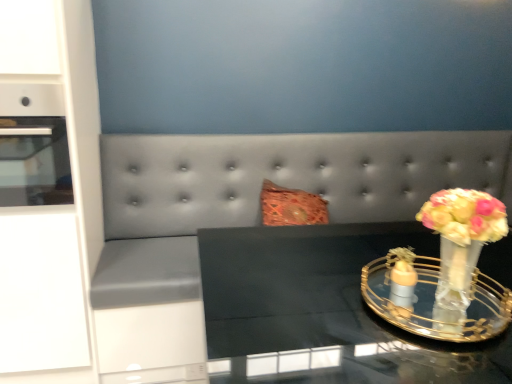
The height and width of the screenshot is (384, 512). Identify the location of translucent glass vase at right. (462, 238).

Describe the element at coordinates (462, 238) in the screenshot. I see `translucent glass vase at right` at that location.

I want to click on clear glass vase at right, which is counted as the first candle holder, starting from the right, so (x=435, y=303).

What do you see at coordinates (401, 279) in the screenshot?
I see `matte orange glass candle holder at right, the 2th candle holder from the right` at bounding box center [401, 279].

Where is `matte orange glass candle holder at right, the 1th candle holder positioned from the left`? Image resolution: width=512 pixels, height=384 pixels. matte orange glass candle holder at right, the 1th candle holder positioned from the left is located at coordinates (401, 279).

Identify the location of translucent glass vase at right. (462, 238).

Is suede gray couch at center facing away from clear glass vase at right, which is counted as the first candle holder, starting from the right?

No, suede gray couch at center is not facing the opposite direction of clear glass vase at right, which is counted as the first candle holder, starting from the right.

Is suede gray couch at center further to the viewer compared to clear glass vase at right, the 2th candle holder from the left?

Yes, it is behind clear glass vase at right, the 2th candle holder from the left.

Does suede gray couch at center appear on the left side of clear glass vase at right, which is counted as the first candle holder, starting from the right?

Correct, you'll find suede gray couch at center to the left of clear glass vase at right, which is counted as the first candle holder, starting from the right.

Does suede gray couch at center have a lesser width compared to clear glass vase at right, which is counted as the first candle holder, starting from the right?

No.

Consider the image. Is white glossy cabinet at left shorter than clear glass vase at right, the 2th candle holder from the left?

No.

Is white glossy cabinet at left oriented towards clear glass vase at right, which is counted as the first candle holder, starting from the right?

No, white glossy cabinet at left is not facing towards clear glass vase at right, which is counted as the first candle holder, starting from the right.

Which of these two, white glossy cabinet at left or clear glass vase at right, which is counted as the first candle holder, starting from the right, is bigger?

white glossy cabinet at left is bigger.

Considering the relative sizes of white glossy cabinet at left and clear glass vase at right, which is counted as the first candle holder, starting from the right, in the image provided, is white glossy cabinet at left thinner than clear glass vase at right, which is counted as the first candle holder, starting from the right,?

No.

Considering the relative positions of matte orange glass candle holder at right, the 2th candle holder from the right, and white glossy cabinet at left in the image provided, is matte orange glass candle holder at right, the 2th candle holder from the right, to the right of white glossy cabinet at left from the viewer's perspective?

Yes, matte orange glass candle holder at right, the 2th candle holder from the right, is to the right of white glossy cabinet at left.

Which of these two, matte orange glass candle holder at right, the 1th candle holder positioned from the left, or white glossy cabinet at left, stands shorter?

With less height is matte orange glass candle holder at right, the 1th candle holder positioned from the left.

Is matte orange glass candle holder at right, the 1th candle holder positioned from the left, not within white glossy cabinet at left?

Yes, matte orange glass candle holder at right, the 1th candle holder positioned from the left, is located beyond the bounds of white glossy cabinet at left.

Can you confirm if matte orange glass candle holder at right, the 1th candle holder positioned from the left, is smaller than white glossy cabinet at left?

Indeed, matte orange glass candle holder at right, the 1th candle holder positioned from the left, has a smaller size compared to white glossy cabinet at left.

Is suede gray couch at center in front of or behind translucent glass vase at right in the image?

suede gray couch at center is behind translucent glass vase at right.

Is suede gray couch at center inside the boundaries of translucent glass vase at right, or outside?

suede gray couch at center exists outside the volume of translucent glass vase at right.

Considering the positions of points (317, 176) and (490, 195), is point (317, 176) farther from camera compared to point (490, 195)?

No, it is not.

Looking at their sizes, would you say matte orange glass candle holder at right, the 1th candle holder positioned from the left, is wider or thinner than clear glass vase at right, the 2th candle holder from the left?

matte orange glass candle holder at right, the 1th candle holder positioned from the left, is thinner than clear glass vase at right, the 2th candle holder from the left.

Is matte orange glass candle holder at right, the 1th candle holder positioned from the left, with clear glass vase at right, which is counted as the first candle holder, starting from the right?

Yes.

From a real-world perspective, who is located higher, matte orange glass candle holder at right, the 2th candle holder from the right, or clear glass vase at right, which is counted as the first candle holder, starting from the right?

matte orange glass candle holder at right, the 2th candle holder from the right, is physically above.

Looking at their sizes, would you say matte orange glass candle holder at right, the 2th candle holder from the right, is wider or thinner than suede gray couch at center?

matte orange glass candle holder at right, the 2th candle holder from the right, is thinner than suede gray couch at center.

Is matte orange glass candle holder at right, the 1th candle holder positioned from the left, aimed at suede gray couch at center?

No, matte orange glass candle holder at right, the 1th candle holder positioned from the left, does not turn towards suede gray couch at center.

Considering their positions, is matte orange glass candle holder at right, the 2th candle holder from the right, located in front of or behind suede gray couch at center?

matte orange glass candle holder at right, the 2th candle holder from the right, is in front of suede gray couch at center.

Which object is positioned more to the right, matte orange glass candle holder at right, the 1th candle holder positioned from the left, or suede gray couch at center?

matte orange glass candle holder at right, the 1th candle holder positioned from the left.

Is point (331, 375) closer to viewer compared to point (444, 168)?

Yes, point (331, 375) is closer to viewer.

Is the position of black glass table at center more distant than that of suede gray couch at center?

No, the depth of black glass table at center is less than that of suede gray couch at center.

From the image's perspective, between black glass table at center and suede gray couch at center, which one is located above?

From the image's view, suede gray couch at center is above.

Which object is thinner, black glass table at center or suede gray couch at center?

suede gray couch at center is thinner.

In order to click on couch beneath the clear glass vase at right, which is counted as the first candle holder, starting from the right (from a real-world perspective) in this screenshot , I will do `click(258, 197)`.

The image size is (512, 384). I want to click on dresser that appears above the clear glass vase at right, which is counted as the first candle holder, starting from the right (from a real-world perspective), so click(x=53, y=206).

Considering their positions, is translucent glass vase at right positioned closer to white glossy cabinet at left than clear glass vase at right, which is counted as the first candle holder, starting from the right?

The object closer to white glossy cabinet at left is clear glass vase at right, which is counted as the first candle holder, starting from the right.

Looking at the image, which one is located further to white glossy cabinet at left, translucent glass vase at right or matte orange glass candle holder at right, the 2th candle holder from the right?

translucent glass vase at right is further to white glossy cabinet at left.

Which object lies nearer to the anchor point suede gray couch at center, matte orange glass candle holder at right, the 1th candle holder positioned from the left, or white glossy cabinet at left?

The object closer to suede gray couch at center is white glossy cabinet at left.

Considering their positions, is white glossy cabinet at left positioned closer to black glass table at center than translucent glass vase at right?

translucent glass vase at right is positioned closer to the anchor black glass table at center.

Considering their positions, is suede gray couch at center positioned further to white glossy cabinet at left than translucent glass vase at right?

Among the two, translucent glass vase at right is located further to white glossy cabinet at left.

From the image, which object appears to be farther from clear glass vase at right, the 2th candle holder from the left, suede gray couch at center or black glass table at center?

Among the two, suede gray couch at center is located further to clear glass vase at right, the 2th candle holder from the left.

Looking at the image, which one is located closer to matte orange glass candle holder at right, the 1th candle holder positioned from the left, clear glass vase at right, the 2th candle holder from the left, or translucent glass vase at right?

clear glass vase at right, the 2th candle holder from the left, is closer to matte orange glass candle holder at right, the 1th candle holder positioned from the left.

Consider the image. Looking at the image, which one is located further to clear glass vase at right, the 2th candle holder from the left, suede gray couch at center or translucent glass vase at right?

suede gray couch at center.

Locate an element on the screen. couch between white glossy cabinet at left and translucent glass vase at right in the horizontal direction is located at coordinates (258, 197).

Where is `couch between white glossy cabinet at left and clear glass vase at right, which is counted as the first candle holder, starting from the right`? The width and height of the screenshot is (512, 384). couch between white glossy cabinet at left and clear glass vase at right, which is counted as the first candle holder, starting from the right is located at coordinates (258, 197).

At what (x,y) coordinates should I click in order to perform the action: click on candle holder between white glossy cabinet at left and clear glass vase at right, which is counted as the first candle holder, starting from the right, from left to right. Please return your answer as a coordinate pair (x, y). The width and height of the screenshot is (512, 384). Looking at the image, I should click on (401, 279).

At what (x,y) coordinates should I click in order to perform the action: click on floral arrangement between clear glass vase at right, the 2th candle holder from the left, and matte orange glass candle holder at right, the 1th candle holder positioned from the left, from front to back. Please return your answer as a coordinate pair (x, y). Image resolution: width=512 pixels, height=384 pixels. Looking at the image, I should click on (462, 238).